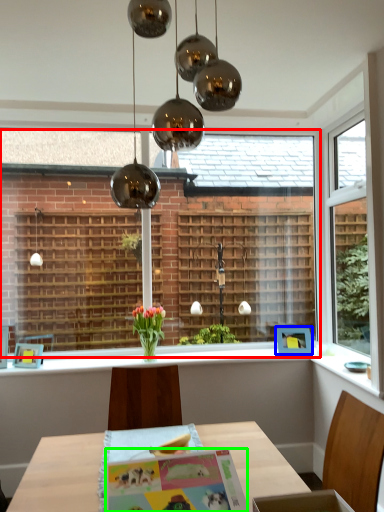
Question: Estimate the real-world distances between objects in this image. Which object is closer to bay window (highlighted by a red box), picture frame (highlighted by a blue box) or postcard (highlighted by a green box)?

Choices:
 (A) picture frame
 (B) postcard

Answer: (A)